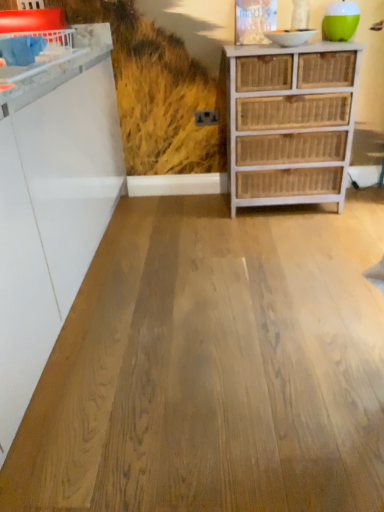
Question: Is white wicker chest of drawers at right in front of natural wood floor at center?

Choices:
 (A) yes
 (B) no

Answer: (B)

Question: Could you tell me if white wicker chest of drawers at right is turned towards natural wood floor at center?

Choices:
 (A) yes
 (B) no

Answer: (A)

Question: Considering the relative positions of white wicker chest of drawers at right and natural wood floor at center in the image provided, is white wicker chest of drawers at right to the right of natural wood floor at center from the viewer's perspective?

Choices:
 (A) yes
 (B) no

Answer: (A)

Question: From the image's perspective, is white wicker chest of drawers at right beneath natural wood floor at center?

Choices:
 (A) yes
 (B) no

Answer: (B)

Question: Considering the relative sizes of white wicker chest of drawers at right and natural wood floor at center in the image provided, is white wicker chest of drawers at right wider than natural wood floor at center?

Choices:
 (A) yes
 (B) no

Answer: (B)

Question: From a real-world perspective, is white wicker chest of drawers at right under natural wood floor at center?

Choices:
 (A) yes
 (B) no

Answer: (B)

Question: Can you see natural wood floor at center touching white wicker chest of drawers at right?

Choices:
 (A) no
 (B) yes

Answer: (A)

Question: Does natural wood floor at center have a lesser height compared to white wicker chest of drawers at right?

Choices:
 (A) yes
 (B) no

Answer: (A)

Question: Is natural wood floor at center smaller than white wicker chest of drawers at right?

Choices:
 (A) no
 (B) yes

Answer: (B)

Question: Is white wicker chest of drawers at right inside natural wood floor at center?

Choices:
 (A) yes
 (B) no

Answer: (B)

Question: Is natural wood floor at center not inside white wicker chest of drawers at right?

Choices:
 (A) no
 (B) yes

Answer: (B)

Question: Would you consider natural wood floor at center to be distant from white wicker chest of drawers at right?

Choices:
 (A) yes
 (B) no

Answer: (B)

Question: Is white glossy counter at upper left shorter than white wicker chest of drawers at right?

Choices:
 (A) no
 (B) yes

Answer: (B)